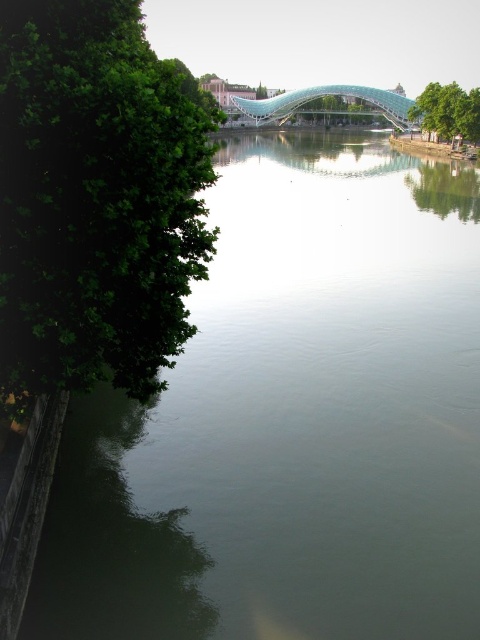
Question: From the image, what is the correct spatial relationship of green leafy tree at left in relation to green leafy tree at center?

Choices:
 (A) left
 (B) right

Answer: (A)

Question: Can you confirm if green leafy tree at left is smaller than green leafy tree at upper right?

Choices:
 (A) yes
 (B) no

Answer: (B)

Question: Is green leafy tree at upper right bigger than green leafy tree at center?

Choices:
 (A) no
 (B) yes

Answer: (B)

Question: Which of the following is the farthest from the observer?

Choices:
 (A) (72, 4)
 (B) (450, 102)
 (C) (257, 97)

Answer: (C)

Question: Which of the following is the closest to the observer?

Choices:
 (A) (420, 122)
 (B) (261, 88)

Answer: (A)

Question: Which of these objects is positioned closest to the green leafy tree at upper right?

Choices:
 (A) green leafy tree at center
 (B) green leafy tree at left

Answer: (B)